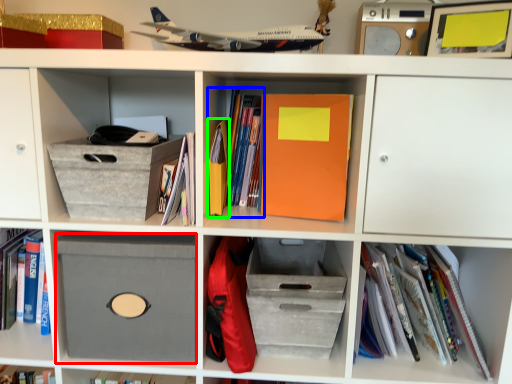
Question: Which is nearer to the cardboard box (highlighted by a red box)? book (highlighted by a blue box) or paperback book (highlighted by a green box).

Choices:
 (A) book
 (B) paperback book

Answer: (B)